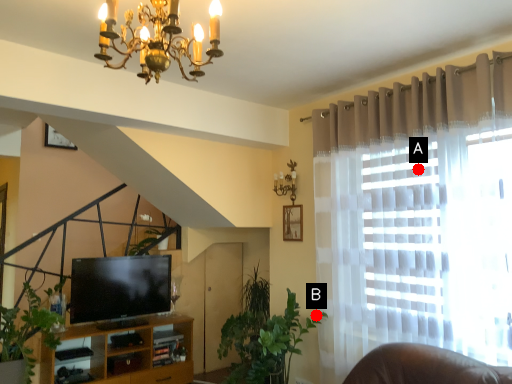
Question: Two points are circled on the image, labeled by A and B beside each circle. Among these points, which one is farthest from the camera?

Choices:
 (A) A is further
 (B) B is further

Answer: (B)